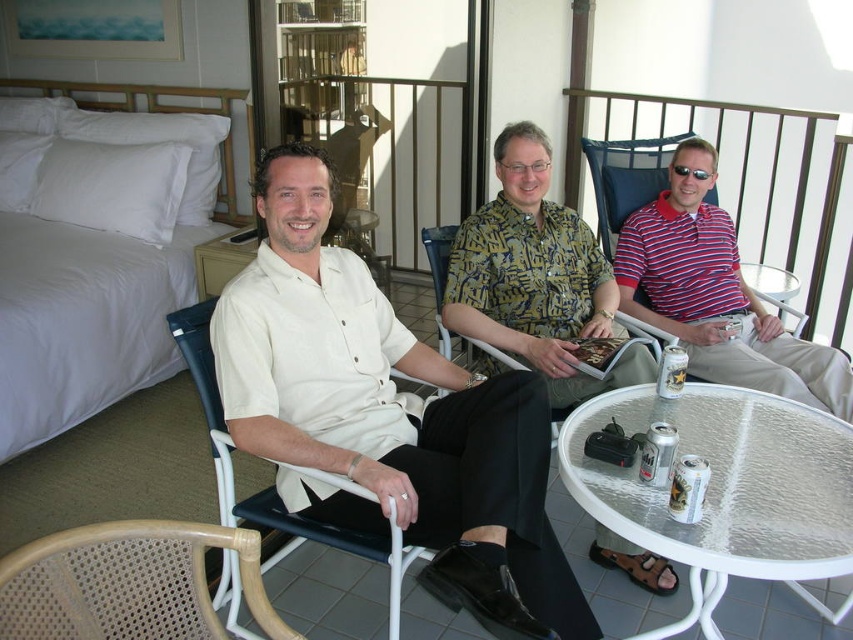
Question: Which of the following is the farthest from the observer?

Choices:
 (A) white textured glass table at lower right
 (B) patterned fabric chair at center
 (C) woven wood chair at lower left
 (D) sunglasses at center

Answer: (D)

Question: Which of the following is the farthest from the observer?

Choices:
 (A) white plastic chair at center
 (B) white textured glass table at lower right

Answer: (A)

Question: Can you confirm if striped polo shirt at center is positioned above woven wood chair at lower left?

Choices:
 (A) no
 (B) yes

Answer: (B)

Question: Can you confirm if white plastic chair at center is thinner than sunglasses at center?

Choices:
 (A) yes
 (B) no

Answer: (B)

Question: Which is farther from the printed fabric shirt at center?

Choices:
 (A) woven wood chair at lower left
 (B) matte white shirt at center

Answer: (A)

Question: Does printed fabric shirt at center appear under white plastic chair at center?

Choices:
 (A) no
 (B) yes

Answer: (A)